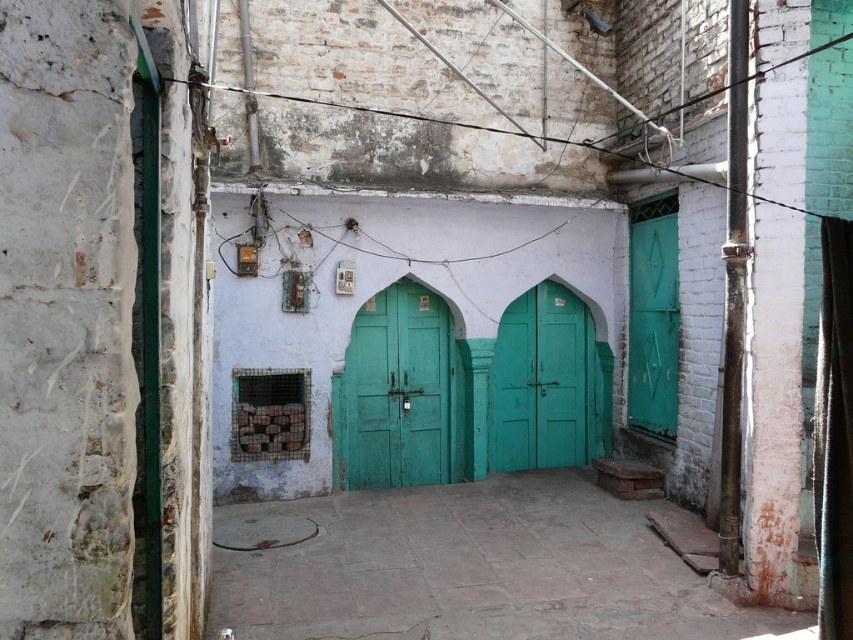
Question: From the image, what is the correct spatial relationship of teal matte door at center in relation to green matte door at center?

Choices:
 (A) right
 (B) left

Answer: (B)

Question: Which point appears closest to the camera in this image?

Choices:
 (A) (642, 260)
 (B) (450, 365)

Answer: (A)

Question: Which point is farther to the camera?

Choices:
 (A) (405, 348)
 (B) (573, 410)

Answer: (B)

Question: Which of the following is the farthest from the observer?

Choices:
 (A) green matte door at right
 (B) teal matte door at center
 (C) green matte door at center

Answer: (C)

Question: Does teal matte door at center come in front of green matte door at center?

Choices:
 (A) no
 (B) yes

Answer: (B)

Question: Is green matte door at center thinner than green matte door at right?

Choices:
 (A) no
 (B) yes

Answer: (A)